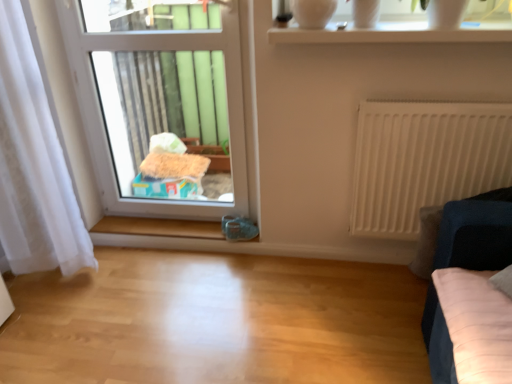
Where is `vacant region to the right of transparent glass vase at upper center`? vacant region to the right of transparent glass vase at upper center is located at coordinates [x=410, y=22].